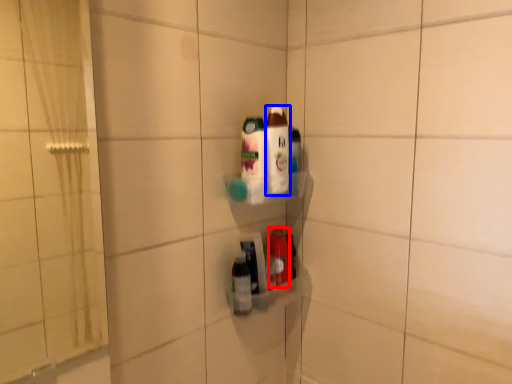
Question: Which object appears farthest to the camera in this image, bottle (highlighted by a red box) or bottle (highlighted by a blue box)?

Choices:
 (A) bottle
 (B) bottle

Answer: (A)